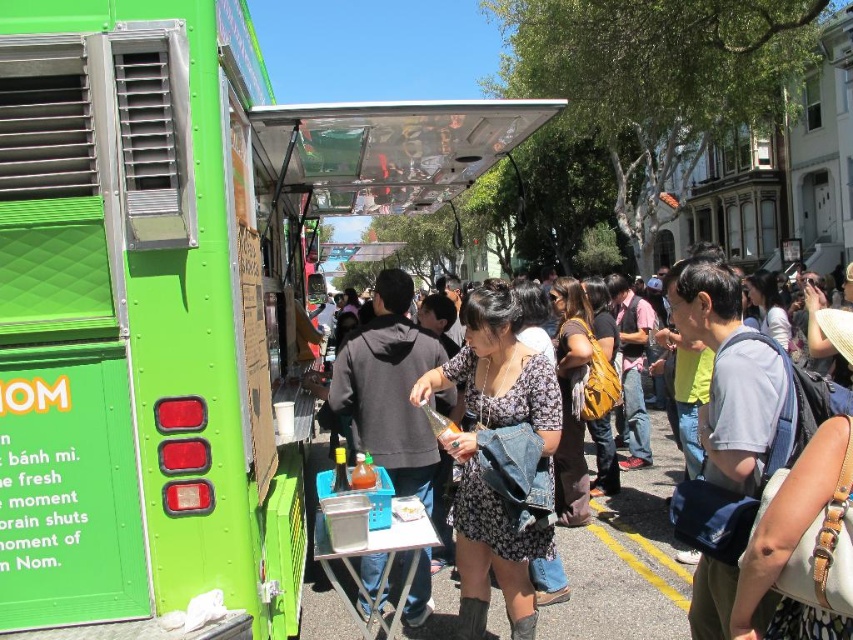
Is point (432, 358) more distant than point (634, 560)?

No.

Where is `dark gray hoodie at center`? dark gray hoodie at center is located at coordinates (390, 388).

Does green matte food truck at center have a lesser width compared to yellow painted line at lower center?

No, green matte food truck at center is not thinner than yellow painted line at lower center.

Is green matte food truck at center bigger than yellow painted line at lower center?

Answer: Correct, green matte food truck at center is larger in size than yellow painted line at lower center.

Who is more distant from viewer, (x=416, y=132) or (x=653, y=579)?

The point (x=653, y=579) is more distant.

Locate an element on the screen. The width and height of the screenshot is (853, 640). green matte food truck at center is located at coordinates (177, 304).

Is point (132, 419) farther from camera compared to point (358, 349)?

No, it is in front of (358, 349).

Which is in front, point (263, 486) or point (364, 570)?

Positioned in front is point (263, 486).

You are a GUI agent. You are given a task and a screenshot of the screen. Output one action in this format:
    pyautogui.click(x=<x>, y=<y>)
    Task: Click on the green matte food truck at center
    The width and height of the screenshot is (853, 640).
    Given the screenshot: What is the action you would take?
    pyautogui.click(x=177, y=304)